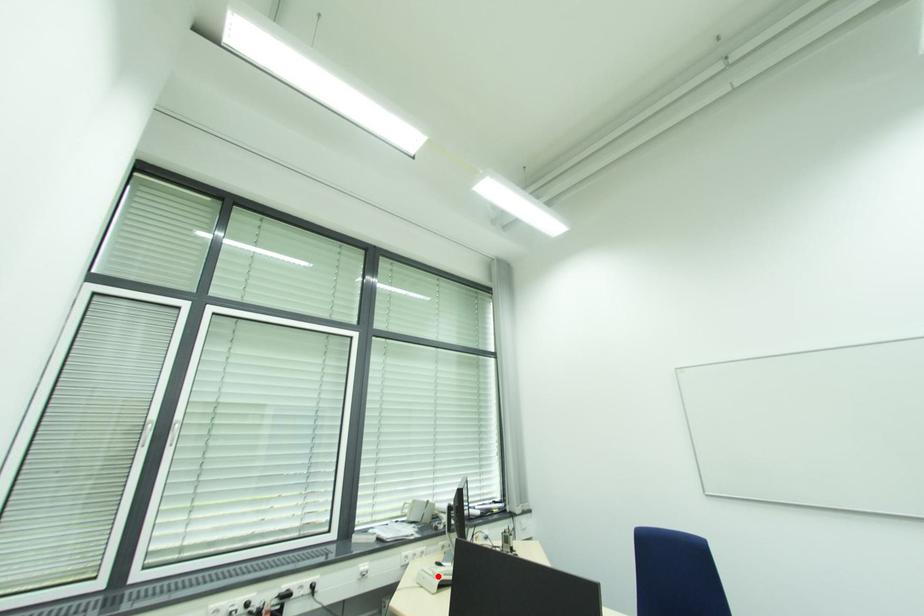
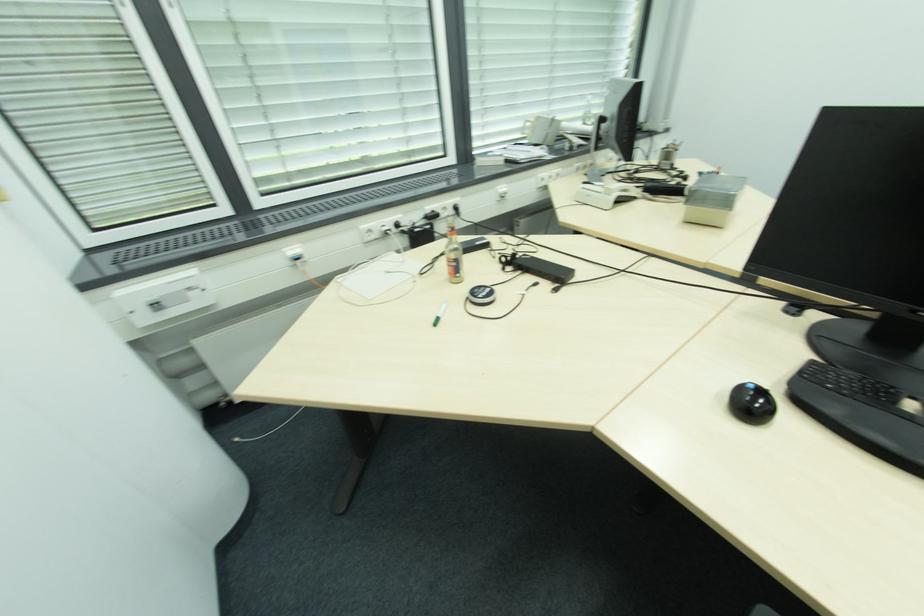
Where in the second image is the point corresponding to the highlighted location from the first image?

(612, 193)